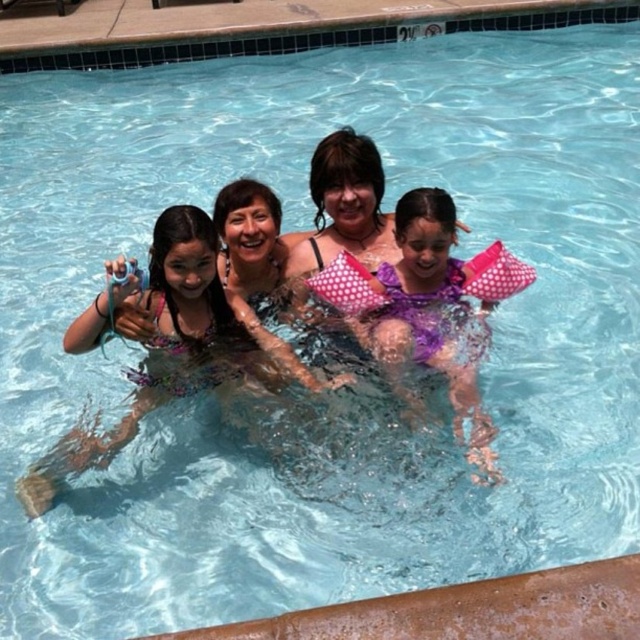
Question: Which point is farther to the camera?

Choices:
 (A) (182, 349)
 (B) (467, 403)

Answer: (A)

Question: Which object appears farthest from the camera in this image?

Choices:
 (A) purple polka dot swimsuit at center
 (B) purple polka dot swimsuit at left

Answer: (A)

Question: Is purple polka dot swimsuit at left positioned behind purple polka dot swimsuit at center?

Choices:
 (A) no
 (B) yes

Answer: (A)

Question: Is purple polka dot swimsuit at left to the left of purple polka dot swimsuit at center from the viewer's perspective?

Choices:
 (A) no
 (B) yes

Answer: (B)

Question: Can you confirm if purple polka dot swimsuit at left is positioned to the left of purple polka dot swimsuit at center?

Choices:
 (A) yes
 (B) no

Answer: (A)